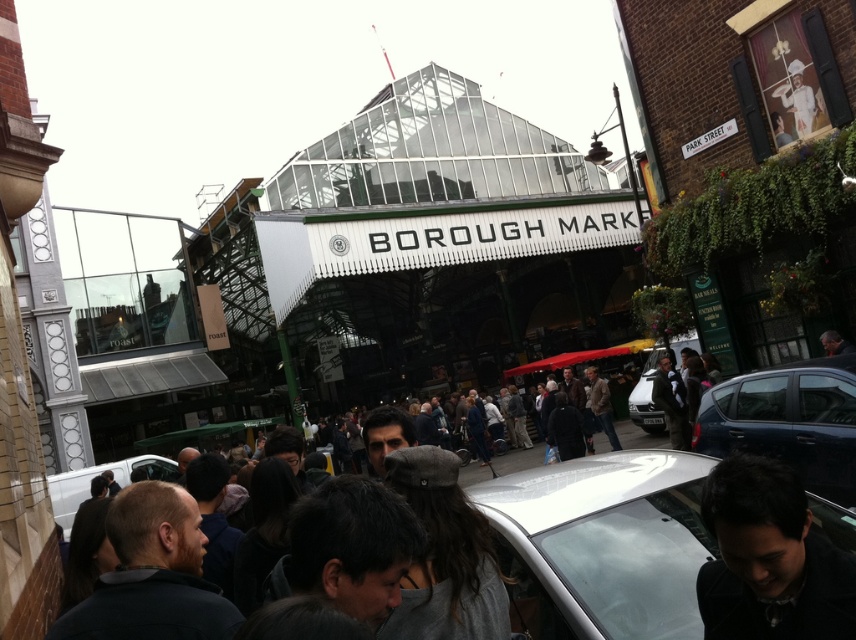
Does dark blue metallic hatchback at lower right appear over white matte van at lower left?

Yes, dark blue metallic hatchback at lower right is above white matte van at lower left.

Based on the photo, who is more distant from viewer, (825,394) or (135,465)?

Point (135,465)

Who is more forward, [770,440] or [49,492]?

Point [770,440]

At what (x,y) coordinates should I click in order to perform the action: click on dark blue metallic hatchback at lower right. Please return your answer as a coordinate pair (x, y). Looking at the image, I should click on (788, 420).

Is the position of white glossy car at lower center less distant than that of dark blue metallic hatchback at lower right?

Yes, it is.

Between white glossy car at lower center and dark blue metallic hatchback at lower right, which one appears on the left side from the viewer's perspective?

From the viewer's perspective, white glossy car at lower center appears more on the left side.

The image size is (856, 640). I want to click on white glossy car at lower center, so (x=602, y=545).

Who is more distant from viewer, (x=718, y=461) or (x=672, y=426)?

The point (x=672, y=426) is behind.

At what (x,y) coordinates should I click in order to perform the action: click on black matte jacket at lower right. Please return your answer as a coordinate pair (x, y). This screenshot has width=856, height=640. Looking at the image, I should click on (770, 560).

I want to click on black matte jacket at lower right, so click(x=770, y=560).

Where is `black matte jacket at lower right`? black matte jacket at lower right is located at coordinates pyautogui.click(x=770, y=560).